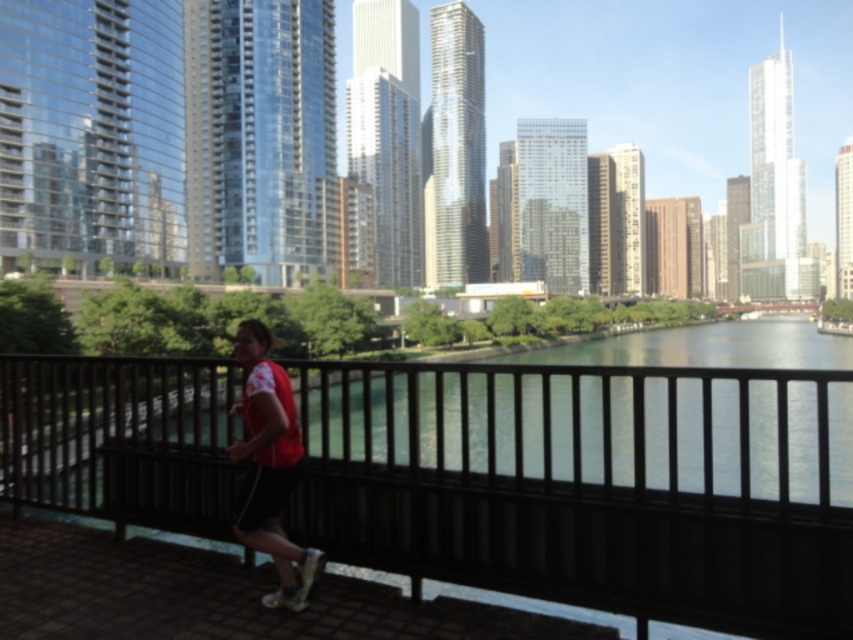
Question: Considering the relative positions of black wood railing at center and red matte shirt at center in the image provided, where is black wood railing at center located with respect to red matte shirt at center?

Choices:
 (A) below
 (B) above

Answer: (A)

Question: Is black wood railing at center to the right of red matte shirt at center from the viewer's perspective?

Choices:
 (A) yes
 (B) no

Answer: (A)

Question: Which point is closer to the camera?

Choices:
 (A) (260, 600)
 (B) (344, 362)

Answer: (A)

Question: Is black wood railing at center to the right of red matte shirt at center from the viewer's perspective?

Choices:
 (A) yes
 (B) no

Answer: (A)